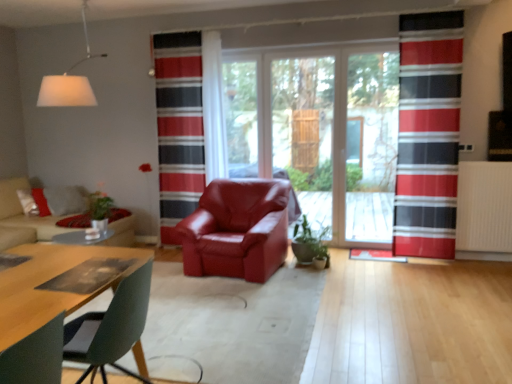
Question: Would you say white matte lampshade at upper left is outside transparent glass screen door at center, which is counted as the first screen door, starting from the right?

Choices:
 (A) no
 (B) yes

Answer: (B)

Question: Could you tell me if white matte lampshade at upper left is facing transparent glass screen door at center, which is counted as the first screen door, starting from the right?

Choices:
 (A) no
 (B) yes

Answer: (A)

Question: Is white matte lampshade at upper left at the left side of transparent glass screen door at center, which is counted as the first screen door, starting from the right?

Choices:
 (A) no
 (B) yes

Answer: (B)

Question: Can you confirm if white matte lampshade at upper left is shorter than transparent glass screen door at center, the 2th screen door when ordered from left to right?

Choices:
 (A) no
 (B) yes

Answer: (B)

Question: Does white matte lampshade at upper left have a greater height compared to transparent glass screen door at center, the 2th screen door when ordered from left to right?

Choices:
 (A) yes
 (B) no

Answer: (B)

Question: In terms of height, does red striped curtain at right, acting as the 1th curtain starting from the front, look taller or shorter compared to white textured radiator at right?

Choices:
 (A) tall
 (B) short

Answer: (A)

Question: Would you say red striped curtain at right, acting as the 1th curtain starting from the front, is to the left or to the right of white textured radiator at right in the picture?

Choices:
 (A) right
 (B) left

Answer: (B)

Question: Looking at their shapes, would you say red striped curtain at right, which is counted as the 1th curtain, starting from the right, is wider or thinner than white textured radiator at right?

Choices:
 (A) thin
 (B) wide

Answer: (A)

Question: Is red striped curtain at right, which is counted as the 1th curtain, starting from the right, inside or outside of white textured radiator at right?

Choices:
 (A) outside
 (B) inside

Answer: (A)

Question: Looking at the image, does red striped curtain at right, which is the second curtain from left to right, seem bigger or smaller compared to green glossy plant at center?

Choices:
 (A) big
 (B) small

Answer: (A)

Question: From the image's perspective, is red striped curtain at right, acting as the 1th curtain starting from the front, located above or below green glossy plant at center?

Choices:
 (A) below
 (B) above

Answer: (B)

Question: Is red striped curtain at right, acting as the 1th curtain starting from the front, spatially inside green glossy plant at center, or outside of it?

Choices:
 (A) inside
 (B) outside

Answer: (B)

Question: Is red striped curtain at right, acting as the 1th curtain starting from the front, to the left or to the right of green glossy plant at center in the image?

Choices:
 (A) right
 (B) left

Answer: (A)

Question: Does point (309, 225) appear closer or farther from the camera than point (302, 91)?

Choices:
 (A) farther
 (B) closer

Answer: (B)

Question: Is green glossy plant at center wider or thinner than transparent glass screen door at center, arranged as the first screen door when viewed from the left?

Choices:
 (A) wide
 (B) thin

Answer: (A)